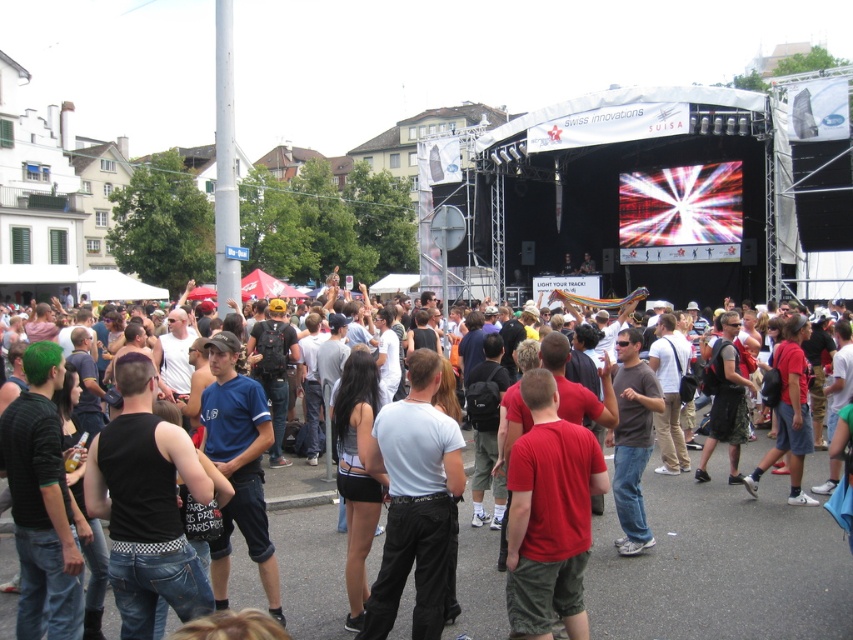
Is red t-shirt at center above light gray cotton t-shirt at center?

No, red t-shirt at center is not above light gray cotton t-shirt at center.

At what (x,y) coordinates should I click in order to perform the action: click on red t-shirt at center. Please return your answer as a coordinate pair (x, y). The width and height of the screenshot is (853, 640). Looking at the image, I should click on (721, 564).

At what (x,y) coordinates should I click in order to perform the action: click on red t-shirt at center. Please return your answer as a coordinate pair (x, y). The width and height of the screenshot is (853, 640). Looking at the image, I should click on (721, 564).